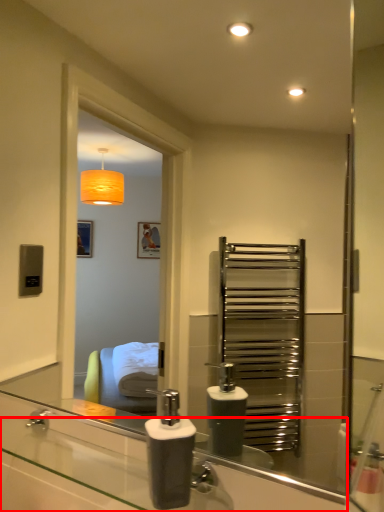
Question: Considering the relative positions of counter top (annotated by the red box) and soap dispenser in the image provided, where is counter top (annotated by the red box) located with respect to the staircase?

Choices:
 (A) left
 (B) right

Answer: (A)